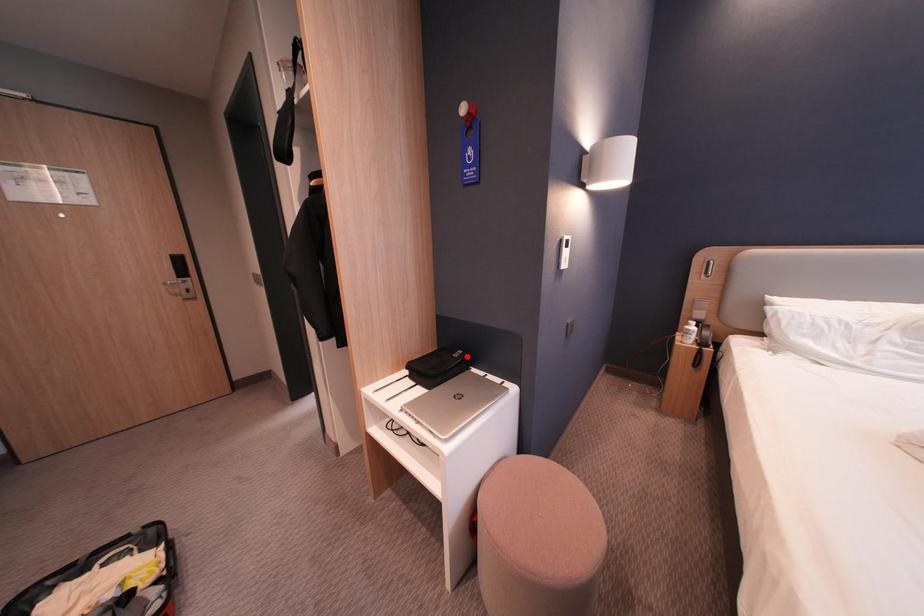
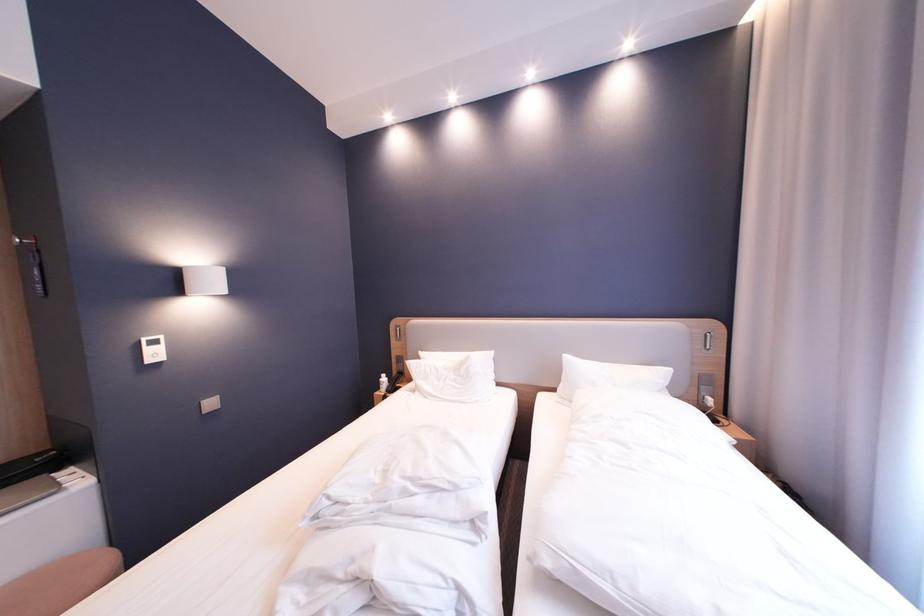
Find the pixel in the second image that matches the highlighted location in the first image.

(51, 460)